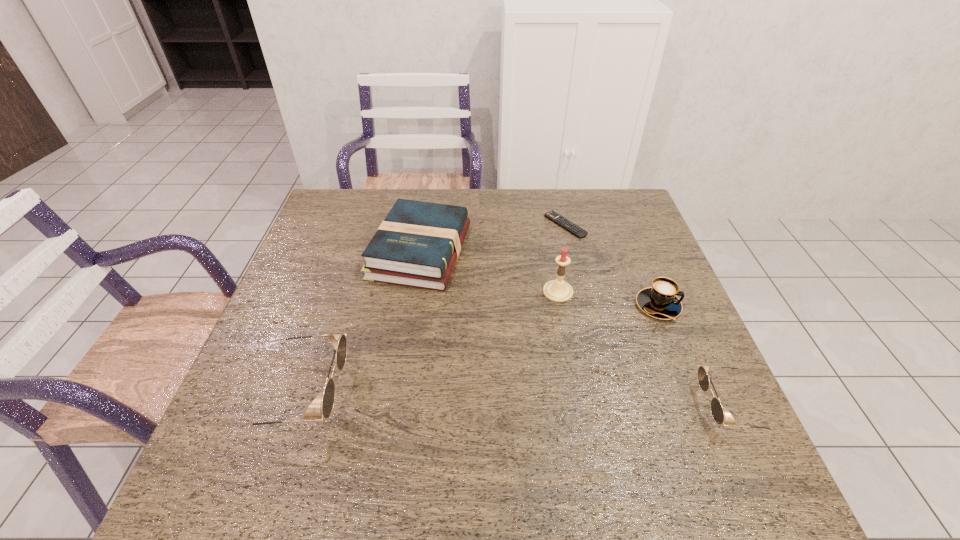
Where is `object present at the near left corner`? This screenshot has width=960, height=540. object present at the near left corner is located at coordinates (339, 341).

Locate an element on the screen. The image size is (960, 540). object that is at the near right corner is located at coordinates (716, 408).

At what (x,y) coordinates should I click in order to perform the action: click on vacant region at the far edge of the desktop. Please return your answer as a coordinate pair (x, y). This screenshot has height=540, width=960. Looking at the image, I should click on (534, 221).

This screenshot has width=960, height=540. In order to click on vacant region at the near edge of the desktop in this screenshot , I will do `click(468, 426)`.

Identify the location of free region at the left edge of the desktop. Image resolution: width=960 pixels, height=540 pixels. (338, 255).

What are the coordinates of `vacant space at the far left corner` in the screenshot? It's located at (326, 200).

This screenshot has height=540, width=960. Find the location of `free space that is in between the taller sunglasses and the shorter sunglasses`. free space that is in between the taller sunglasses and the shorter sunglasses is located at coordinates (516, 399).

Where is `free space between the tallest object and the cappuccino`? This screenshot has width=960, height=540. free space between the tallest object and the cappuccino is located at coordinates (608, 299).

Image resolution: width=960 pixels, height=540 pixels. Identify the location of vacant area between the hardback book and the shortest object. (492, 238).

You are a GUI agent. You are given a task and a screenshot of the screen. Output one action in this format:
    pyautogui.click(x=<x>, y=<y>)
    Task: Click on the vacant point located between the right sunglasses and the cappuccino
    The image size is (960, 540).
    Given the screenshot: What is the action you would take?
    pyautogui.click(x=695, y=356)